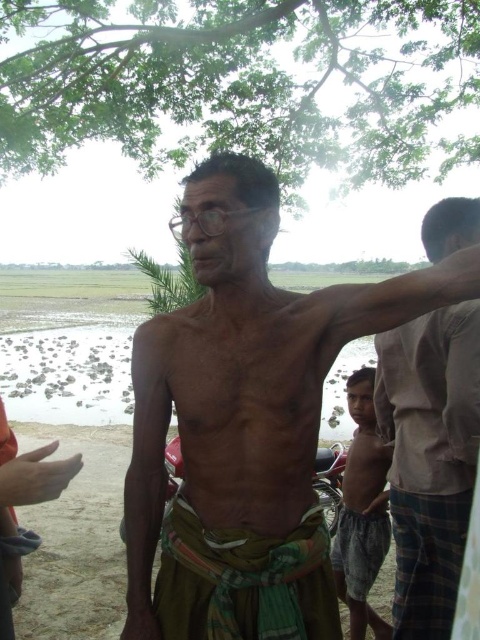
Question: Does green leafy tree at upper center appear under gray cotton shirt at right?

Choices:
 (A) no
 (B) yes

Answer: (A)

Question: Is brown skin man at center wider than green leafy tree at upper center?

Choices:
 (A) no
 (B) yes

Answer: (A)

Question: Is brown skin man at center below gray cotton shirt at right?

Choices:
 (A) yes
 (B) no

Answer: (B)

Question: Which of these objects is positioned closest to the green leafy tree at upper center?

Choices:
 (A) gray cotton shirt at right
 (B) brown skin man at center

Answer: (A)

Question: Which of these objects is positioned closest to the gray cotton shirt at right?

Choices:
 (A) green leafy tree at upper center
 (B) brown skin man at center

Answer: (B)

Question: Among these objects, which one is farthest from the camera?

Choices:
 (A) gray cotton shirt at right
 (B) brown skin man at center

Answer: (A)